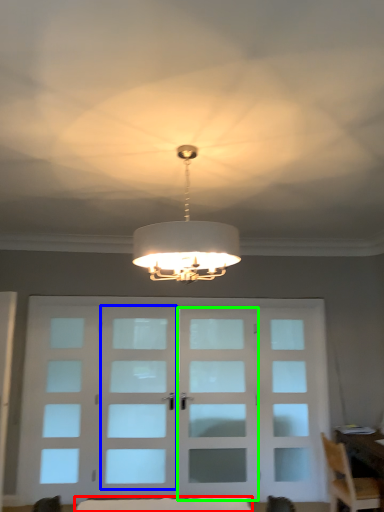
Question: Which object is positioned closest to furniture (highlighted by a red box)? Select from screen door (highlighted by a blue box) and screen door (highlighted by a green box).

Choices:
 (A) screen door
 (B) screen door

Answer: (B)